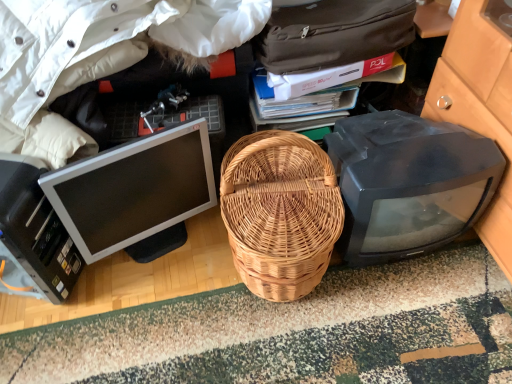
This screenshot has width=512, height=384. What are the coordinates of `free space on the front side of matte black monitor at right, the first computer monitor when ordered from right to left` in the screenshot? It's located at (406, 319).